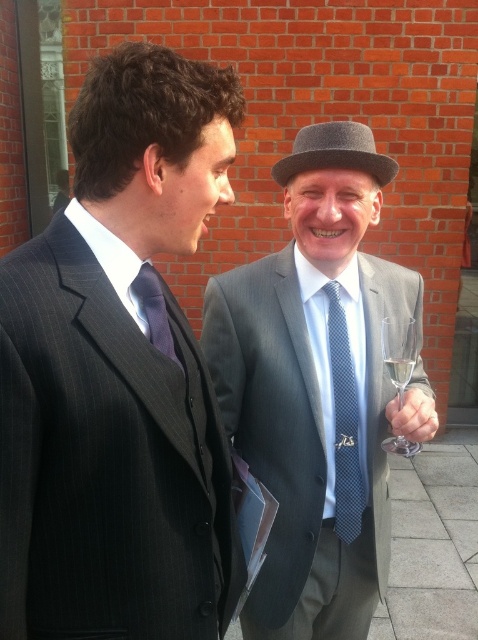
You are a photographer setting up for an event. You need to ensure that both the gray wool suit at center and the gray felt fedora at upper center are visible in your photo. Based on their positions, which object should you focus on first to capture both in the frame?

The gray wool suit at center is in front of the gray felt fedora at upper center, so you should focus on the gray wool suit at center first to ensure both are visible in the frame.